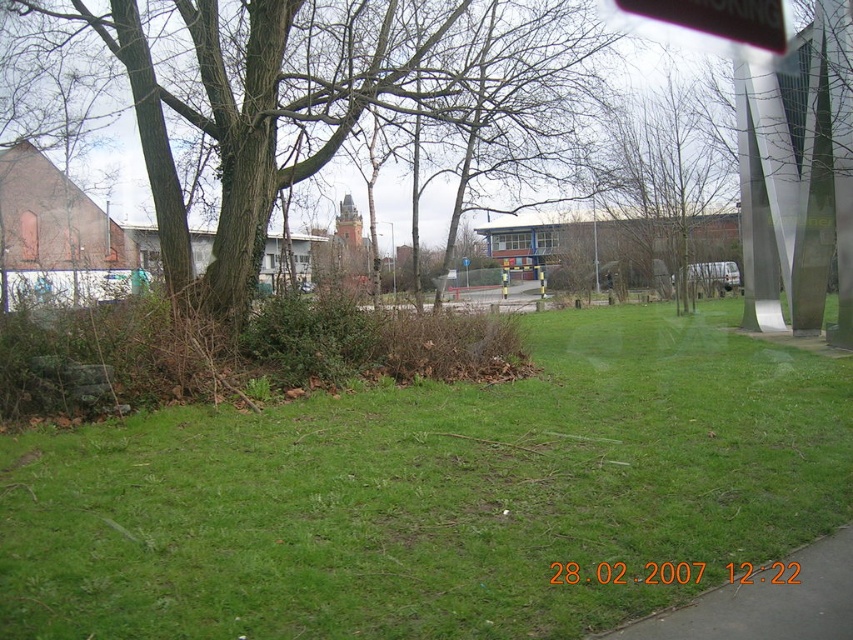
Who is higher up, green grass at center or brown rough bark tree at left?

brown rough bark tree at left

Between point (151, 536) and point (531, 22), which one is positioned in front?

Point (151, 536)

Who is more forward, (682, 451) or (184, 49)?

Positioned in front is point (682, 451).

Locate an element on the screen. The height and width of the screenshot is (640, 853). green grass at center is located at coordinates (434, 493).

Based on the photo, can you confirm if green grass at center is positioned below black plastic sign at upper center?

Yes, green grass at center is below black plastic sign at upper center.

Which is behind, point (540, 637) or point (763, 13)?

The point (763, 13) is more distant.

Is point (614, 500) farther from viewer compared to point (621, 3)?

No, (614, 500) is closer to viewer.

Where is `green grass at center`? This screenshot has height=640, width=853. green grass at center is located at coordinates (434, 493).

Between point (231, 236) and point (668, 4), which one is positioned behind?

Positioned behind is point (668, 4).

The width and height of the screenshot is (853, 640). Describe the element at coordinates (339, 104) in the screenshot. I see `brown rough bark tree at left` at that location.

Locate an element on the screen. brown rough bark tree at left is located at coordinates (339, 104).